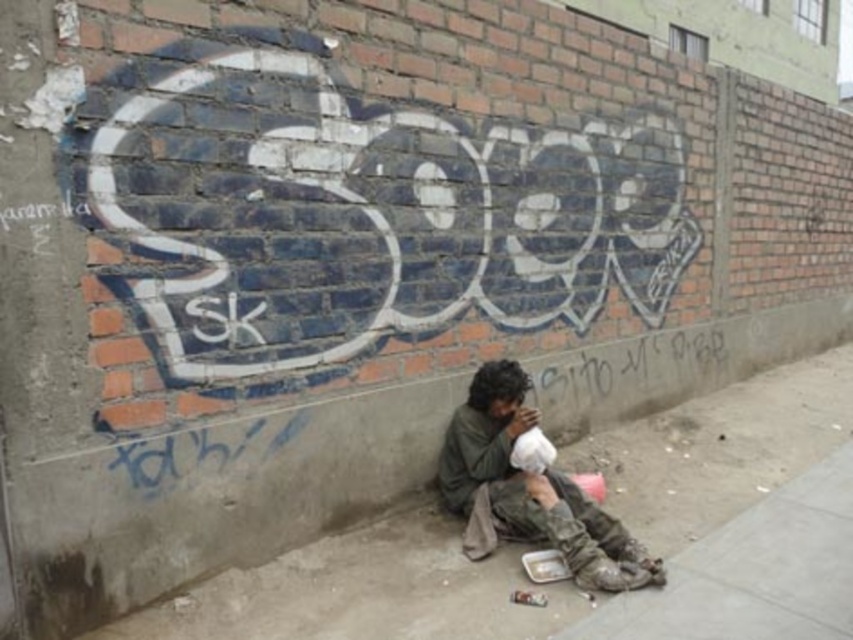
Identify the location of concrete pavement at lower center. (363, 589).

Is point (637, 452) positioned before point (613, 566)?

No.

This screenshot has width=853, height=640. I want to click on concrete pavement at lower center, so click(363, 589).